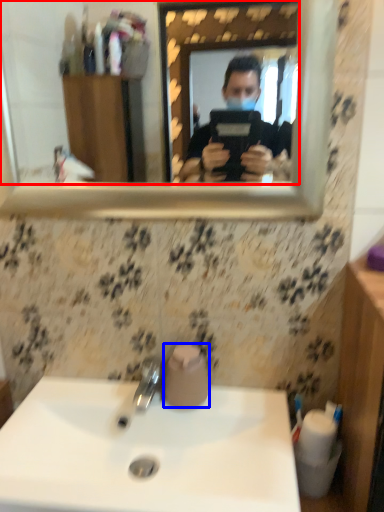
Question: Which point is further to the camera, mirror (highlighted by a red box) or toilet paper (highlighted by a blue box)?

Choices:
 (A) mirror
 (B) toilet paper

Answer: (B)